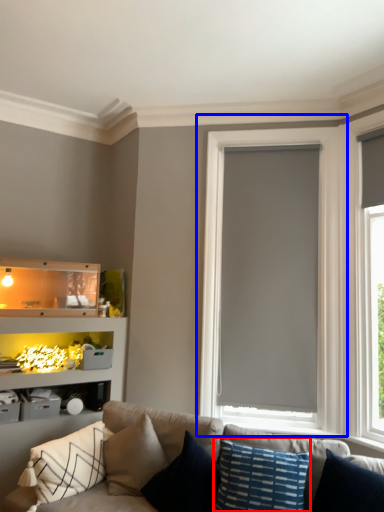
Question: Which object is further to the camera taking this photo, pillow (highlighted by a red box) or window (highlighted by a blue box)?

Choices:
 (A) pillow
 (B) window

Answer: (B)